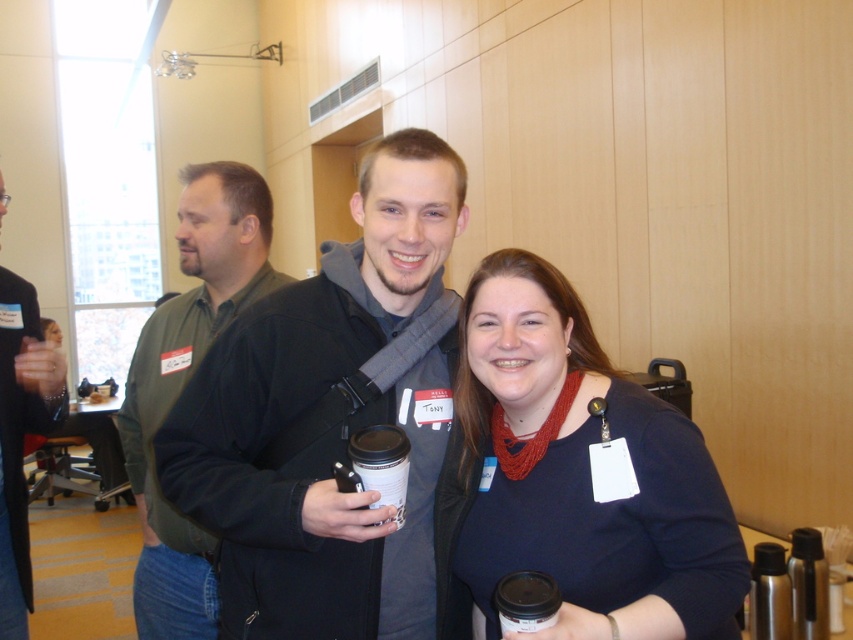
Does point (335, 333) come behind point (703, 515)?

Yes, point (335, 333) is behind point (703, 515).

At what (x,y) coordinates should I click in order to perform the action: click on black matte jacket at center. Please return your answer as a coordinate pair (x, y). Looking at the image, I should click on (334, 424).

Between point (173, 321) and point (27, 381), which one is positioned in front?

Point (27, 381) is more forward.

Is point (173, 602) positioned behind point (10, 614)?

Yes, point (173, 602) is behind point (10, 614).

Locate an element on the screen. The width and height of the screenshot is (853, 640). green matte jacket at left is located at coordinates (186, 380).

Who is taller, black matte jacket at center or black matte jacket at left?

Standing taller between the two is black matte jacket at left.

Is point (413, 365) positioned after point (0, 397)?

No, (413, 365) is closer to viewer.

The image size is (853, 640). Identify the location of black matte jacket at center. (334, 424).